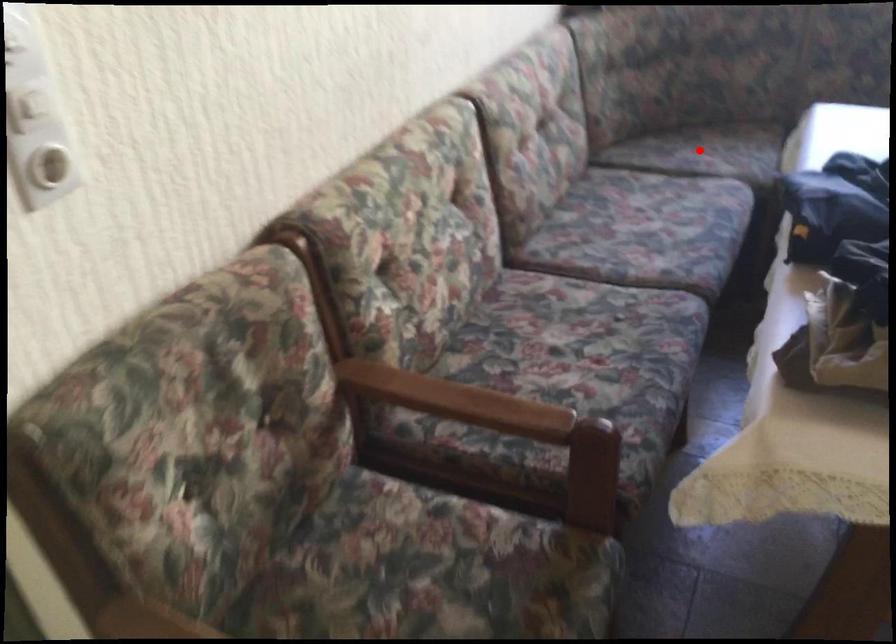
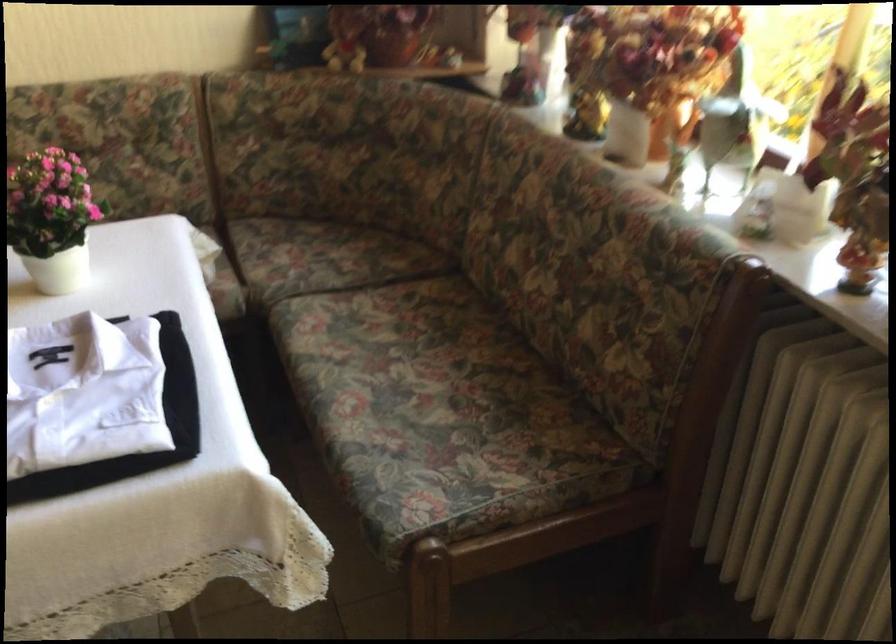
Question: I am providing you with two images of the same scene from different viewpoints. Given a red point in image1, look at the same physical point in image2. Is it:

Choices:
 (A) Closer to the viewpoint
 (B) Farther from the viewpoint

Answer: (A)